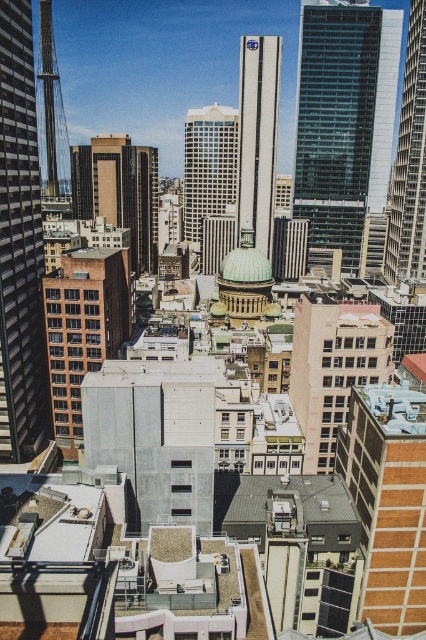
Is the position of beige brick building at center more distant than that of brown brick building at left?

No, beige brick building at center is in front of brown brick building at left.

Where is `beige brick building at center`? The image size is (426, 640). beige brick building at center is located at coordinates (333, 368).

You are a GUI agent. You are given a task and a screenshot of the screen. Output one action in this format:
    pyautogui.click(x=<x>, y=<y>)
    Task: Click on the beige brick building at center
    This screenshot has height=640, width=426.
    Given the screenshot: What is the action you would take?
    pos(333,368)

Which of these two, beige brick building at center or brown brick building at center, stands taller?

brown brick building at center is taller.

Can you confirm if beige brick building at center is taller than brown brick building at center?

No, beige brick building at center is not taller than brown brick building at center.

Is point (317, 470) positioned in front of point (71, 180)?

Yes, it is.

In order to click on beige brick building at center in this screenshot , I will do `click(333, 368)`.

Is transparent glass skyscraper at center taller than brown brick building at left?

Indeed, transparent glass skyscraper at center has a greater height compared to brown brick building at left.

Is transparent glass skyscraper at center to the right of brown brick building at left from the viewer's perspective?

Correct, you'll find transparent glass skyscraper at center to the right of brown brick building at left.

This screenshot has width=426, height=640. Describe the element at coordinates (344, 120) in the screenshot. I see `transparent glass skyscraper at center` at that location.

I want to click on transparent glass skyscraper at center, so click(344, 120).